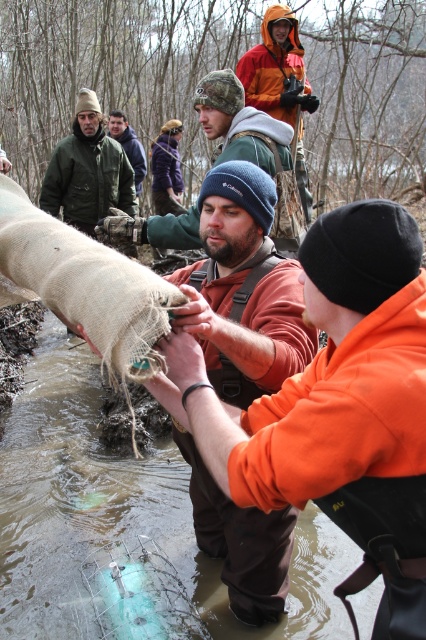
Does matte brown bag at center have a larger size compared to green woolen hat at upper center?

Actually, matte brown bag at center might be smaller than green woolen hat at upper center.

The image size is (426, 640). I want to click on matte brown bag at center, so click(x=242, y=289).

Is point (212, 484) positioned before point (115, 132)?

Yes, it is.

You are a GUI agent. You are given a task and a screenshot of the screen. Output one action in this format:
    pyautogui.click(x=<x>, y=<y>)
    Task: Click on the matte brown bag at center
    This screenshot has height=640, width=426.
    Given the screenshot: What is the action you would take?
    pyautogui.click(x=242, y=289)

Where is `orange fleece jacket at center`? orange fleece jacket at center is located at coordinates (325, 372).

Between point (406, 429) and point (81, 145), which one is positioned in front?

Point (406, 429) is more forward.

Is point (365, 417) farther from viewer compared to point (103, 164)?

No, (365, 417) is closer to viewer.

What are the coordinates of `orange fleece jacket at center` in the screenshot? It's located at (325, 372).

Which of these two, orange fleece jacket at center or matte brown jacket at center, stands shorter?

orange fleece jacket at center

Who is higher up, orange fleece jacket at center or matte brown jacket at center?

matte brown jacket at center

Which is behind, point (379, 202) or point (271, 138)?

The point (271, 138) is more distant.

What are the coordinates of `orange fleece jacket at center` in the screenshot? It's located at 325,372.